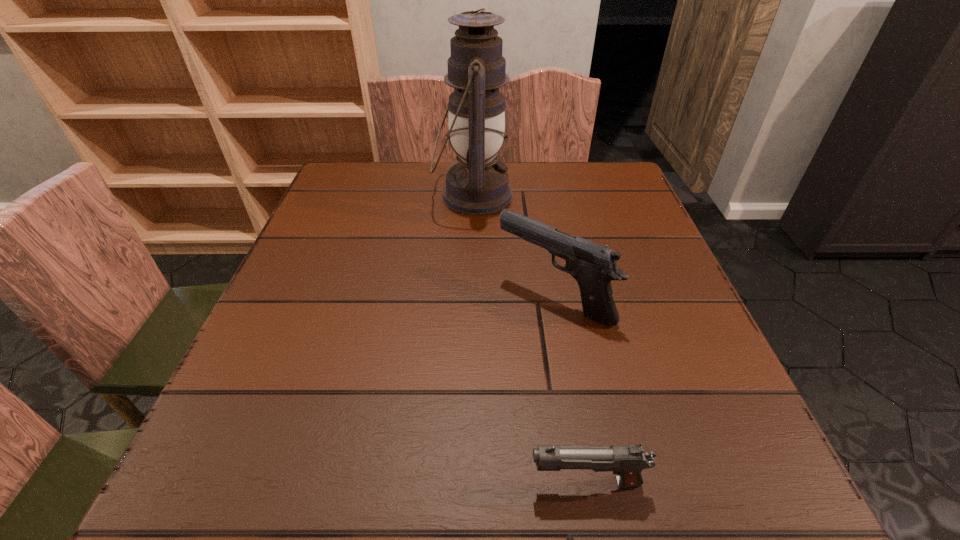
Identify the location of free point between the taller gun and the oil lamp. The width and height of the screenshot is (960, 540). (514, 246).

The width and height of the screenshot is (960, 540). I want to click on free spot between the taller gun and the nearer gun, so click(x=570, y=390).

Identify which object is located as the second nearest to the taller gun. Please provide its 2D coordinates. Your answer should be formatted as a tuple, i.e. [(x, y)], where the tuple contains the x and y coordinates of a point satisfying the conditions above.

[(627, 461)]

At what (x,y) coordinates should I click in order to perform the action: click on the closest object relative to the second tallest object. Please return your answer as a coordinate pair (x, y). This screenshot has width=960, height=540. Looking at the image, I should click on (x=476, y=185).